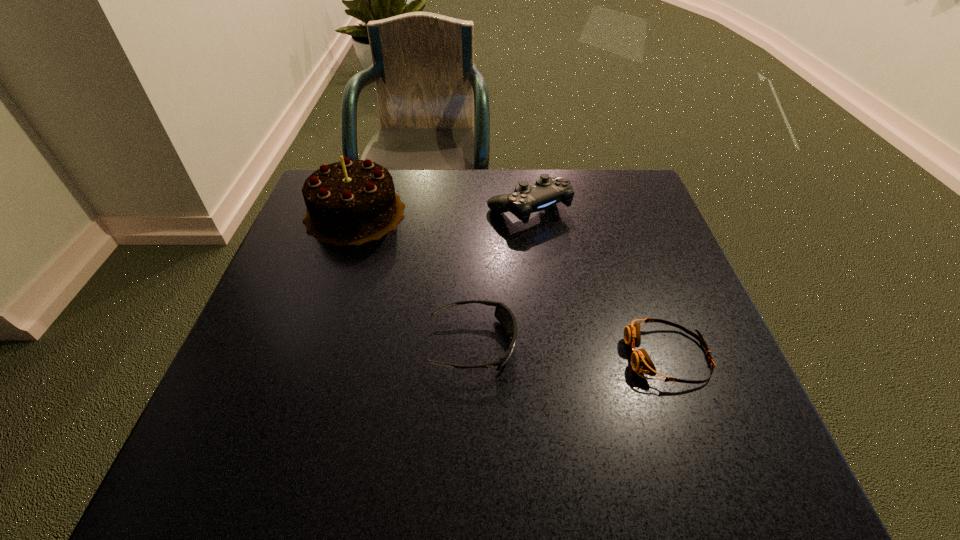
At what (x,y) coordinates should I click in order to perform the action: click on free space between the tallest object and the control. Please return your answer as a coordinate pair (x, y). The width and height of the screenshot is (960, 540). Looking at the image, I should click on (442, 211).

At what (x,y) coordinates should I click in order to perform the action: click on vacant space in between the control and the left goggles. Please return your answer as a coordinate pair (x, y). The width and height of the screenshot is (960, 540). Looking at the image, I should click on (501, 276).

The height and width of the screenshot is (540, 960). What are the coordinates of `object that stands as the second closest to the birthday cake` in the screenshot? It's located at (503, 314).

You are a GUI agent. You are given a task and a screenshot of the screen. Output one action in this format:
    pyautogui.click(x=<x>, y=<y>)
    Task: Click on the third closest object relative to the shorter goggles
    The width and height of the screenshot is (960, 540).
    Given the screenshot: What is the action you would take?
    pyautogui.click(x=351, y=202)